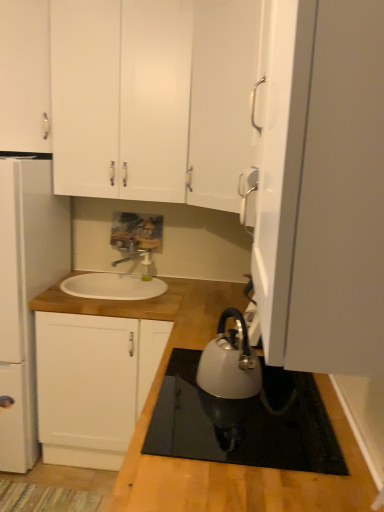
Question: From the image's perspective, is white matte cabinet at upper left, the third cabinetry from the bottom, positioned above or below white matte cabinet at upper center, placed as the second cabinetry when sorted from bottom to top?

Choices:
 (A) below
 (B) above

Answer: (B)

Question: Is white matte cabinet at upper left, the third cabinetry from the bottom, inside the boundaries of white matte cabinet at upper center, placed as the second cabinetry when sorted from bottom to top, or outside?

Choices:
 (A) inside
 (B) outside

Answer: (B)

Question: Considering the real-world distances, which object is farthest from the silver metallic faucet at center?

Choices:
 (A) white matte cabinet at upper left, marked as the first cabinetry in a top-to-bottom arrangement
 (B) white wood cabinet at center, which is counted as the first cabinetry, starting from the bottom
 (C) satin silver kettle at lower center
 (D) white matte refrigerator at left
 (E) white matte cabinet at upper center, the second cabinetry positioned from the top

Answer: (C)

Question: Considering the real-world distances, which object is farthest from the white matte refrigerator at left?

Choices:
 (A) white matte cabinet at upper center, the second cabinetry positioned from the top
 (B) satin silver kettle at lower center
 (C) silver metallic faucet at center
 (D) white matte cabinet at upper left, the third cabinetry from the bottom
 (E) white wood cabinet at center, which is counted as the first cabinetry, starting from the bottom

Answer: (B)